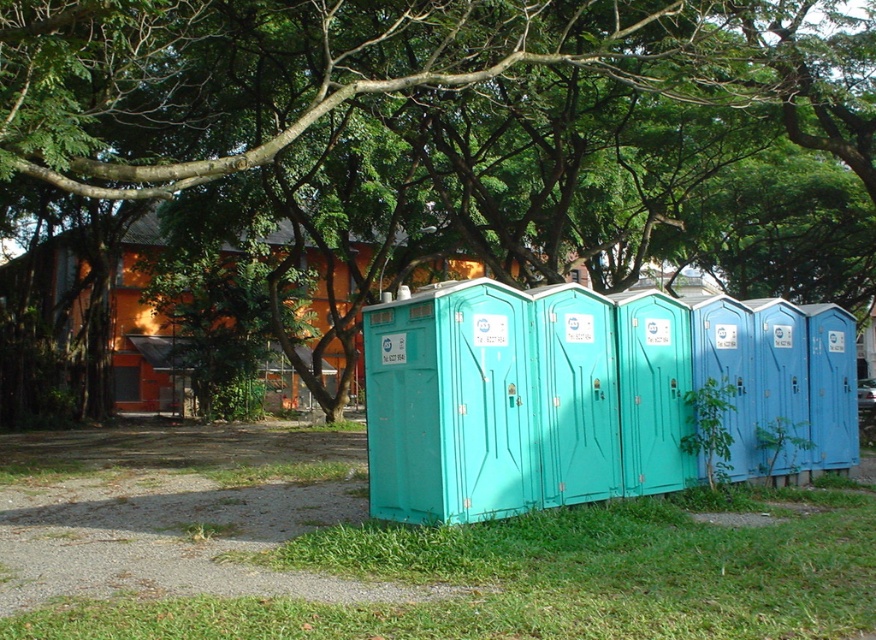
Question: Can you confirm if green grass at lower center is smaller than teal plastic porta-potty at center?

Choices:
 (A) no
 (B) yes

Answer: (B)

Question: Observing the image, what is the correct spatial positioning of green leafy tree at upper center in reference to green grass at lower center?

Choices:
 (A) right
 (B) left

Answer: (A)

Question: Which point is farther to the camera?

Choices:
 (A) green grass at lower center
 (B) teal plastic porta-potty at center
 (C) green leafy tree at upper center

Answer: (B)

Question: Does green leafy tree at upper center appear on the right side of teal plastic porta-potty at center?

Choices:
 (A) no
 (B) yes

Answer: (B)

Question: Based on their relative distances, which object is farther from the teal plastic porta-potty at center?

Choices:
 (A) green leafy tree at upper center
 (B) green grass at lower center

Answer: (B)

Question: Estimate the real-world distances between objects in this image. Which object is closer to the green leafy tree at upper center?

Choices:
 (A) green grass at lower center
 (B) teal plastic porta-potty at center

Answer: (B)